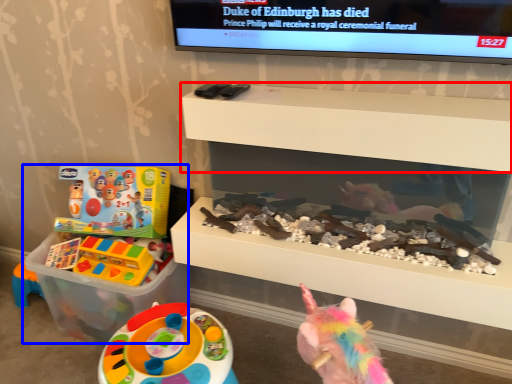
Question: Which object appears farthest to the camera in this image, shelf (highlighted by a red box) or toy (highlighted by a blue box)?

Choices:
 (A) shelf
 (B) toy

Answer: (B)